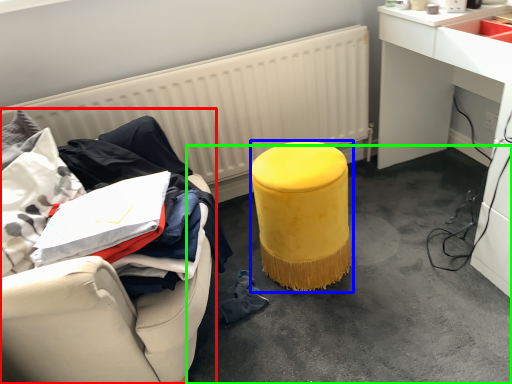
Question: Which object is positioned farthest from furniture (highlighted by a red box)? Select from stool (highlighted by a blue box) and concrete (highlighted by a green box).

Choices:
 (A) stool
 (B) concrete

Answer: (B)